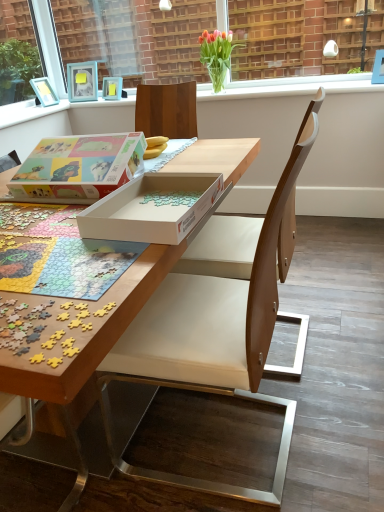
What do you see at coordinates (92, 333) in the screenshot? I see `wooden puzzle pieces at center` at bounding box center [92, 333].

The width and height of the screenshot is (384, 512). I want to click on vivid tulips in glass vase at upper center, so click(217, 55).

Find the location of a particular element. The image size is (384, 512). pastel matte puzzle box at center is located at coordinates (78, 168).

You are a GUI agent. You are given a task and a screenshot of the screen. Output one action in this format:
    pyautogui.click(x=<x>, y=<y>)
    Task: Click on the wooden puzzle pieces at center
    This screenshot has width=384, height=512.
    Given the screenshot: What is the action you would take?
    pyautogui.click(x=92, y=333)

Which of these two, wooden chair at center or white cardboard box at center, stands taller?

wooden chair at center is taller.

Which is farther, (229, 282) or (154, 237)?

The point (229, 282) is more distant.

How many degrees apart are the facing directions of wooden chair at center and white cardboard box at center?

The angular difference between wooden chair at center and white cardboard box at center is 88.8 degrees.

Is wooden chair at center facing away from white cardboard box at center?

Correct, wooden chair at center is looking away from white cardboard box at center.

Which of these two, clear glass window frame at upper center or matte blue picture frame at upper left, stands taller?

clear glass window frame at upper center.

Considering the positions of objects clear glass window frame at upper center and matte blue picture frame at upper left in the image provided, who is in front, clear glass window frame at upper center or matte blue picture frame at upper left?

clear glass window frame at upper center.

Considering the positions of points (140, 51) and (121, 79), is point (140, 51) farther from camera compared to point (121, 79)?

Yes, it is.

Can you confirm if clear glass window frame at upper center is thinner than matte blue picture frame at upper left?

Indeed, clear glass window frame at upper center has a lesser width compared to matte blue picture frame at upper left.

Can wooden puzzle pieces at center be found inside clear glass window frame at upper center?

No, wooden puzzle pieces at center is not inside clear glass window frame at upper center.

Measure the distance from clear glass window frame at upper center to wooden puzzle pieces at center.

clear glass window frame at upper center and wooden puzzle pieces at center are 8.56 feet apart.

Considering the points (143, 2) and (115, 316), which point is behind, point (143, 2) or point (115, 316)?

Point (143, 2)

Could you tell me if clear glass window frame at upper center is turned towards wooden puzzle pieces at center?

No, clear glass window frame at upper center is not turned towards wooden puzzle pieces at center.

Is pastel matte puzzle box at center located outside vivid tulips in glass vase at upper center?

Absolutely, pastel matte puzzle box at center is external to vivid tulips in glass vase at upper center.

Who is more distant, pastel matte puzzle box at center or vivid tulips in glass vase at upper center?

vivid tulips in glass vase at upper center is further from the camera.

Considering the relative sizes of pastel matte puzzle box at center and vivid tulips in glass vase at upper center in the image provided, is pastel matte puzzle box at center wider than vivid tulips in glass vase at upper center?

Yes.

Which is more to the right, pastel matte puzzle box at center or vivid tulips in glass vase at upper center?

Positioned to the right is vivid tulips in glass vase at upper center.

How many degrees apart are the facing directions of white cardboard box at center and pastel matte puzzle box at center?

176 degrees separate the facing orientations of white cardboard box at center and pastel matte puzzle box at center.

In the scene shown: From the image's perspective, does white cardboard box at center appear higher than pastel matte puzzle box at center?

No, from the image's perspective, white cardboard box at center is not on top of pastel matte puzzle box at center.

Does point (130, 216) come behind point (91, 187)?

That is False.

Where is `cardboard box behind the white cardboard box at center`? This screenshot has height=512, width=384. cardboard box behind the white cardboard box at center is located at coordinates [78, 168].

Does wooden puzzle pieces at center touch matte blue picture frame at upper left?

No, wooden puzzle pieces at center is not making contact with matte blue picture frame at upper left.

Does wooden puzzle pieces at center have a larger size compared to matte blue picture frame at upper left?

Yes.

Is point (13, 387) positioned in front of point (112, 80)?

Yes, it is.

Could you tell me if wooden puzzle pieces at center is facing matte blue picture frame at upper left?

No, wooden puzzle pieces at center is not aimed at matte blue picture frame at upper left.

Which of these two, wooden puzzle pieces at center or clear glass window frame at upper center, stands shorter?

With less height is clear glass window frame at upper center.

Which is correct: wooden puzzle pieces at center is inside clear glass window frame at upper center, or outside of it?

wooden puzzle pieces at center cannot be found inside clear glass window frame at upper center.

Is the depth of wooden puzzle pieces at center less than that of clear glass window frame at upper center?

Yes, wooden puzzle pieces at center is closer to the camera.

Is wooden puzzle pieces at center aimed at clear glass window frame at upper center?

No, wooden puzzle pieces at center is not facing towards clear glass window frame at upper center.

At what (x,y) coordinates should I click in order to perform the action: click on chair that is below the white cardboard box at center (from the image's perspective). Please return your answer as a coordinate pair (x, y). Image resolution: width=384 pixels, height=512 pixels. Looking at the image, I should click on (215, 332).

Where is `window frame on the right of matte blue picture frame at upper left`? Image resolution: width=384 pixels, height=512 pixels. window frame on the right of matte blue picture frame at upper left is located at coordinates (131, 38).

Looking at the image, which one is located further to white cardboard box at center, clear glass window frame at upper center or matte blue picture frame at upper left?

Based on the image, clear glass window frame at upper center appears to be further to white cardboard box at center.

Consider the image. Based on their spatial positions, is vivid tulips in glass vase at upper center or matte blue picture frame at upper left further from wooden chair at center?

The object further to wooden chair at center is matte blue picture frame at upper left.

Which object lies further to the anchor point white cardboard box at center, pastel matte puzzle box at center or wooden puzzle pieces at center?

The object further to white cardboard box at center is pastel matte puzzle box at center.

When comparing their distances from wooden chair at center, does clear glass window frame at upper center or matte blue picture frame at upper left seem further?

clear glass window frame at upper center lies further to wooden chair at center than the other object.

Based on their spatial positions, is vivid tulips in glass vase at upper center or wooden chair at center closer to wooden puzzle pieces at center?

The object closer to wooden puzzle pieces at center is wooden chair at center.

Estimate the real-world distances between objects in this image. Which object is further from matte blue picture frame at upper left, clear glass window frame at upper center or pastel matte puzzle box at center?

Based on the image, clear glass window frame at upper center appears to be further to matte blue picture frame at upper left.

Estimate the real-world distances between objects in this image. Which object is closer to matte blue picture frame at upper left, vivid tulips in glass vase at upper center or pastel matte puzzle box at center?

vivid tulips in glass vase at upper center lies closer to matte blue picture frame at upper left than the other object.

Based on their spatial positions, is clear glass window frame at upper center or wooden puzzle pieces at center further from pastel matte puzzle box at center?

Based on the image, clear glass window frame at upper center appears to be further to pastel matte puzzle box at center.

Identify the location of cardboard box between wooden chair at center and clear glass window frame at upper center along the z-axis. (78, 168).

Where is `cardboard box between white cardboard box at center and matte blue picture frame at upper left in the front-back direction`? This screenshot has height=512, width=384. cardboard box between white cardboard box at center and matte blue picture frame at upper left in the front-back direction is located at coordinates [78, 168].

Where is `window frame positioned between pastel matte puzzle box at center and matte blue picture frame at upper left from near to far`? The width and height of the screenshot is (384, 512). window frame positioned between pastel matte puzzle box at center and matte blue picture frame at upper left from near to far is located at coordinates (131, 38).

Where is `box between wooden chair at center and pastel matte puzzle box at center in the front-back direction`? The image size is (384, 512). box between wooden chair at center and pastel matte puzzle box at center in the front-back direction is located at coordinates (152, 208).